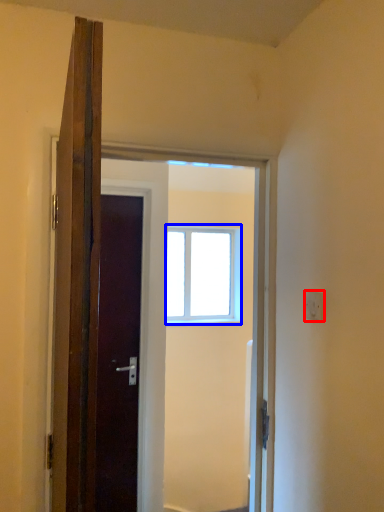
Question: Which object is closer to the camera taking this photo, electric outlet (highlighted by a red box) or window (highlighted by a blue box)?

Choices:
 (A) electric outlet
 (B) window

Answer: (A)